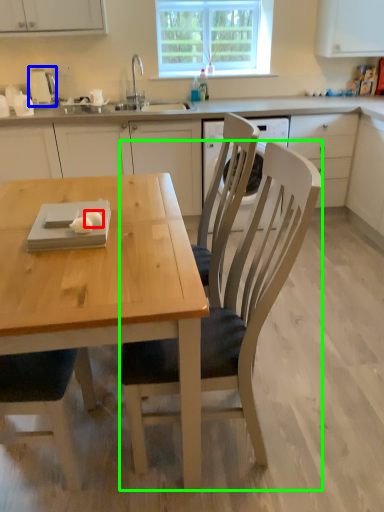
Question: Based on their relative distances, which object is farther from food (highlighted by a red box)? Choose from appliance (highlighted by a blue box) and chair (highlighted by a green box).

Choices:
 (A) appliance
 (B) chair

Answer: (A)